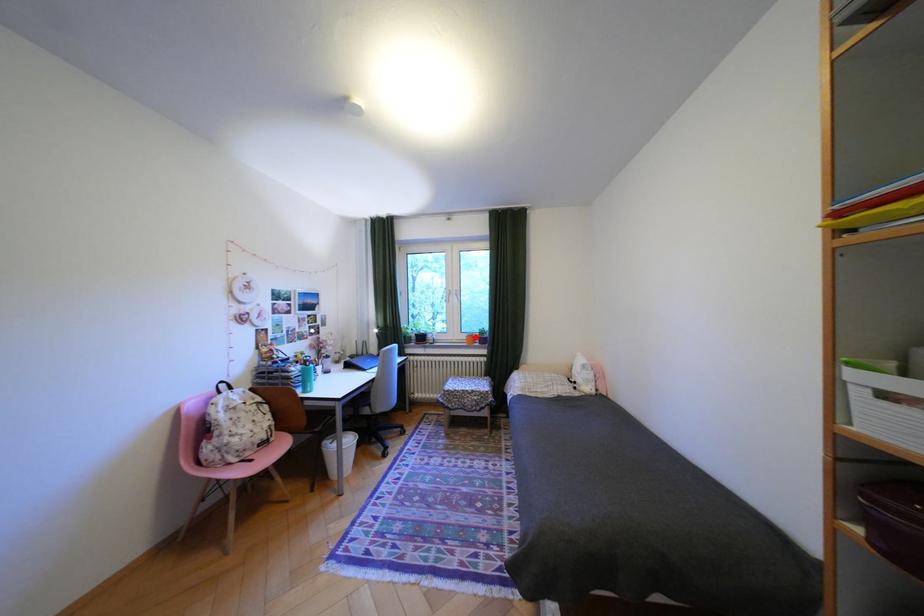
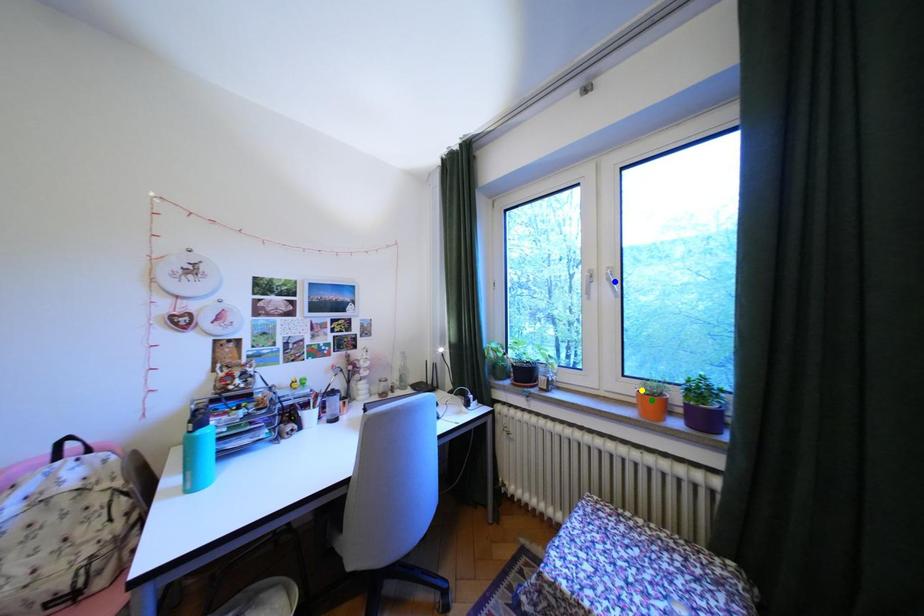
Question: I am providing you with two images of the same scene from different viewpoints. A red point is marked on the first image. You are given multiple points on the second image. Can you choose the point in image 2 that corresponds to the point in image 1?

Choices:
 (A) blue point
 (B) green point
 (C) yellow point

Answer: (C)